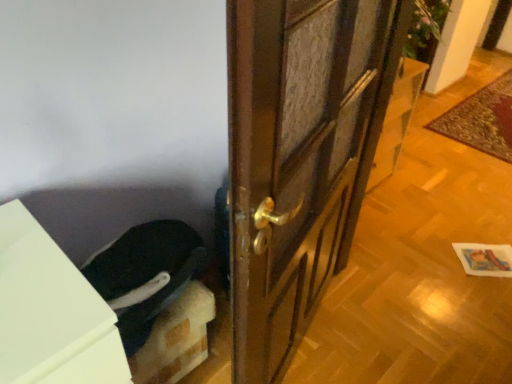
The width and height of the screenshot is (512, 384). In order to click on vacant point above white matte cabinet at lower left (from a real-world perspective) in this screenshot , I will do `click(26, 283)`.